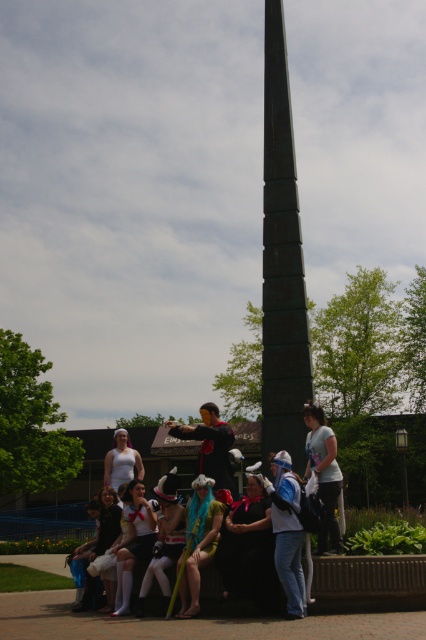
Question: Does denim jeans at lower center come in front of smooth black cape at center?

Choices:
 (A) no
 (B) yes

Answer: (B)

Question: Which object is the farthest from the black fabric dress at lower left?

Choices:
 (A) smooth black cape at center
 (B) turquoise fabric dress at center

Answer: (A)

Question: Which object is closer to the camera taking this photo?

Choices:
 (A) denim jeans at lower center
 (B) smooth black cape at center

Answer: (A)

Question: Which point is farther from the camera taking this photo?

Choices:
 (A) (299, 593)
 (B) (175, 492)
 (C) (106, 520)
 (D) (120, 444)

Answer: (D)

Question: Is white matte cosplay outfit at center below smooth black cape at center?

Choices:
 (A) no
 (B) yes

Answer: (B)

Question: Is black satin dress at center to the right of white matte tank top at center from the viewer's perspective?

Choices:
 (A) yes
 (B) no

Answer: (A)